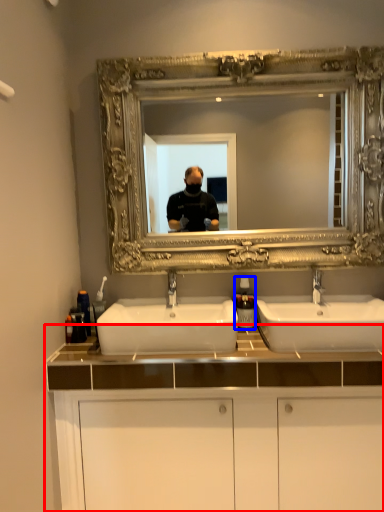
Question: Which object is closer to the camera taking this photo, bathroom cabinet (highlighted by a red box) or soap dispenser (highlighted by a blue box)?

Choices:
 (A) bathroom cabinet
 (B) soap dispenser

Answer: (A)